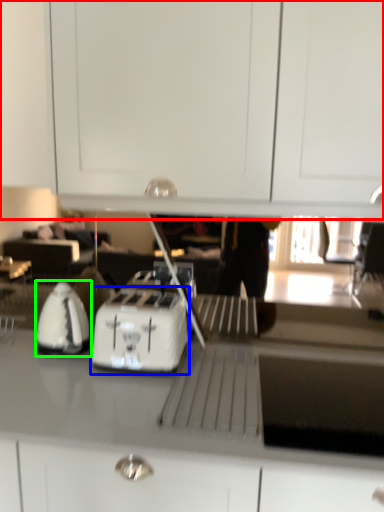
Question: Estimate the real-world distances between objects in this image. Which object is closer to dresser (highlighted by a red box), kitchen appliance (highlighted by a blue box) or home appliance (highlighted by a green box)?

Choices:
 (A) kitchen appliance
 (B) home appliance

Answer: (A)